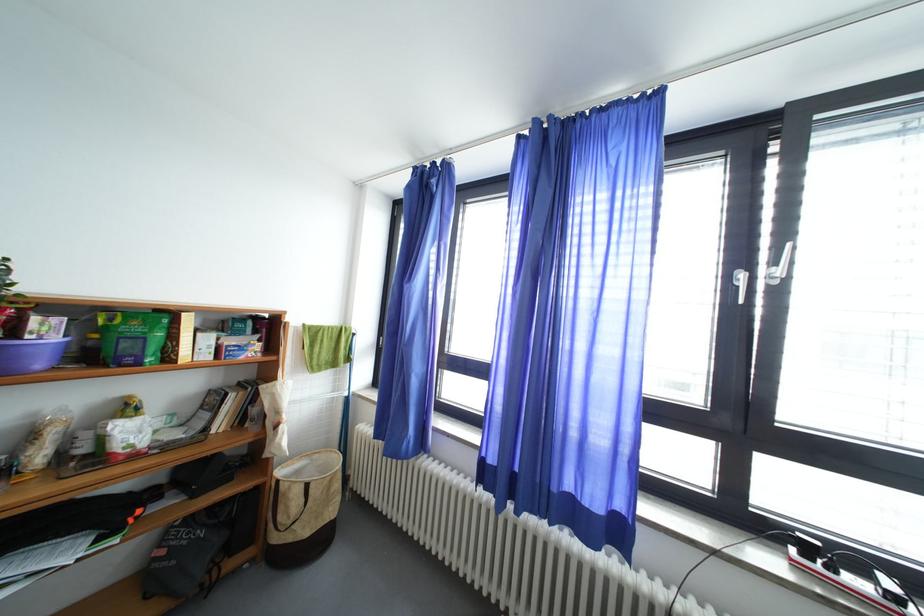
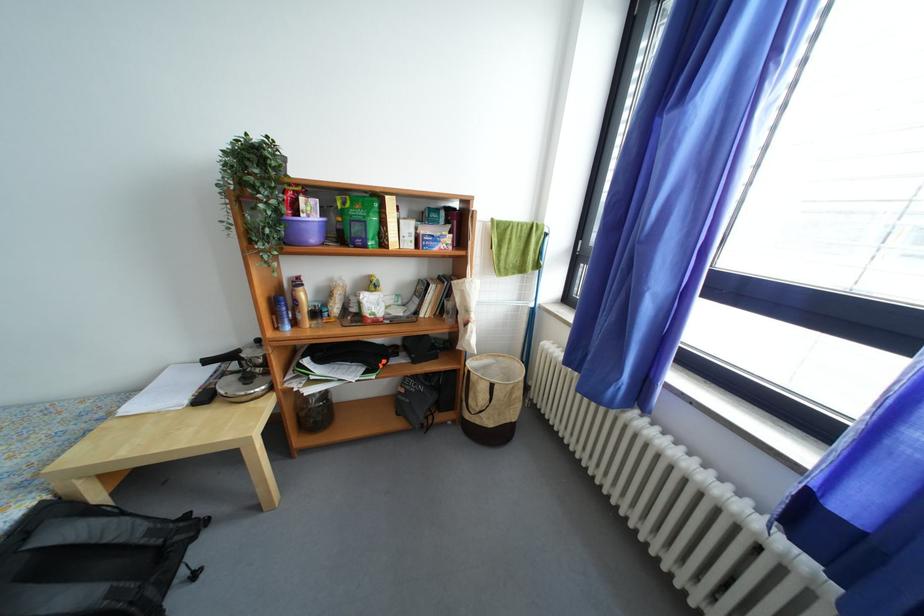
Find the pixel in the second image that matches point 103,341 in the first image.

(346, 224)